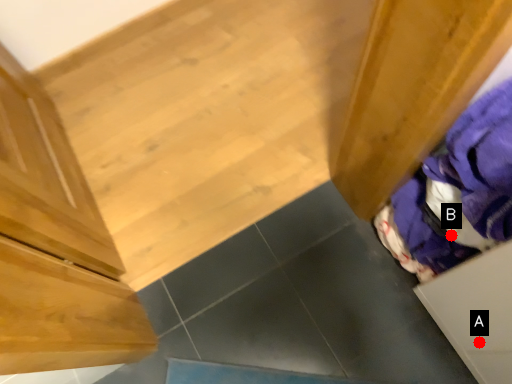
Question: Two points are circled on the image, labeled by A and B beside each circle. Which point appears farthest from the camera in this image?

Choices:
 (A) A is further
 (B) B is further

Answer: (A)